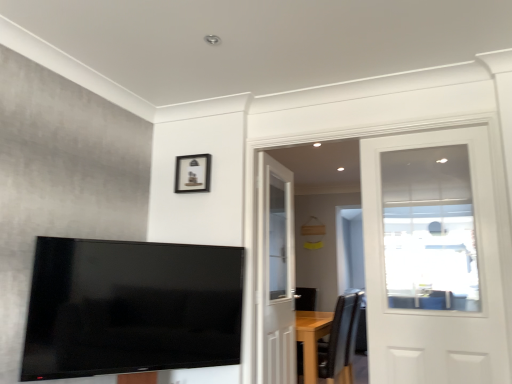
Question: Can you confirm if black leather chair at lower right is smaller than matte black picture frame at upper center?

Choices:
 (A) no
 (B) yes

Answer: (A)

Question: Can you confirm if black leather chair at lower right is bigger than matte black picture frame at upper center?

Choices:
 (A) yes
 (B) no

Answer: (A)

Question: From a real-world perspective, is black leather chair at lower right positioned over matte black picture frame at upper center based on gravity?

Choices:
 (A) no
 (B) yes

Answer: (A)

Question: Considering the relative sizes of black leather chair at lower right and matte black picture frame at upper center in the image provided, is black leather chair at lower right thinner than matte black picture frame at upper center?

Choices:
 (A) yes
 (B) no

Answer: (B)

Question: Considering the relative sizes of black leather chair at lower right and matte black picture frame at upper center in the image provided, is black leather chair at lower right shorter than matte black picture frame at upper center?

Choices:
 (A) no
 (B) yes

Answer: (A)

Question: Is white glossy door at upper right, arranged as the 2th door when viewed from the back, spatially inside flat screen tv at lower left, or outside of it?

Choices:
 (A) inside
 (B) outside

Answer: (B)

Question: In terms of size, does white glossy door at upper right, which is the 1th door from front to back, appear bigger or smaller than flat screen tv at lower left?

Choices:
 (A) small
 (B) big

Answer: (A)

Question: In terms of width, does white glossy door at upper right, positioned as the first door in right-to-left order, look wider or thinner when compared to flat screen tv at lower left?

Choices:
 (A) thin
 (B) wide

Answer: (A)

Question: From their relative heights in the image, would you say white glossy door at upper right, positioned as the first door in right-to-left order, is taller or shorter than flat screen tv at lower left?

Choices:
 (A) tall
 (B) short

Answer: (A)

Question: Would you say white glossy door at upper right, arranged as the 2th door when viewed from the back, is to the left or to the right of matte black picture frame at upper center in the picture?

Choices:
 (A) right
 (B) left

Answer: (A)

Question: From their relative heights in the image, would you say white glossy door at upper right, arranged as the 2th door when viewed from the back, is taller or shorter than matte black picture frame at upper center?

Choices:
 (A) short
 (B) tall

Answer: (B)

Question: Which is correct: white glossy door at upper right, positioned as the first door in right-to-left order, is inside matte black picture frame at upper center, or outside of it?

Choices:
 (A) outside
 (B) inside

Answer: (A)

Question: Does point (417, 382) appear closer or farther from the camera than point (200, 170)?

Choices:
 (A) closer
 (B) farther

Answer: (A)

Question: Looking at the image, does matte black picture frame at upper center seem bigger or smaller compared to white wooden door at center, which is counted as the 1th door, starting from the back?

Choices:
 (A) small
 (B) big

Answer: (A)

Question: In the image, is matte black picture frame at upper center positioned in front of or behind white wooden door at center, which is counted as the 1th door, starting from the back?

Choices:
 (A) front
 (B) behind

Answer: (B)